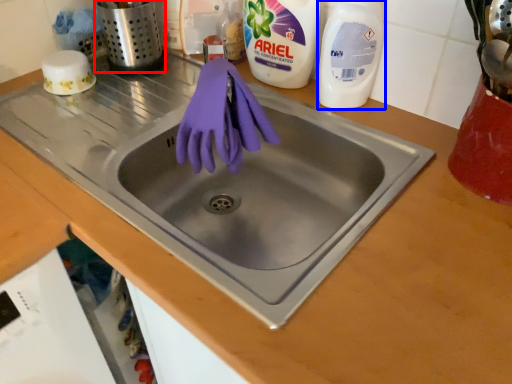
Question: Which point is closer to the camera, appliance (highlighted by a red box) or cleaning product (highlighted by a blue box)?

Choices:
 (A) appliance
 (B) cleaning product

Answer: (B)